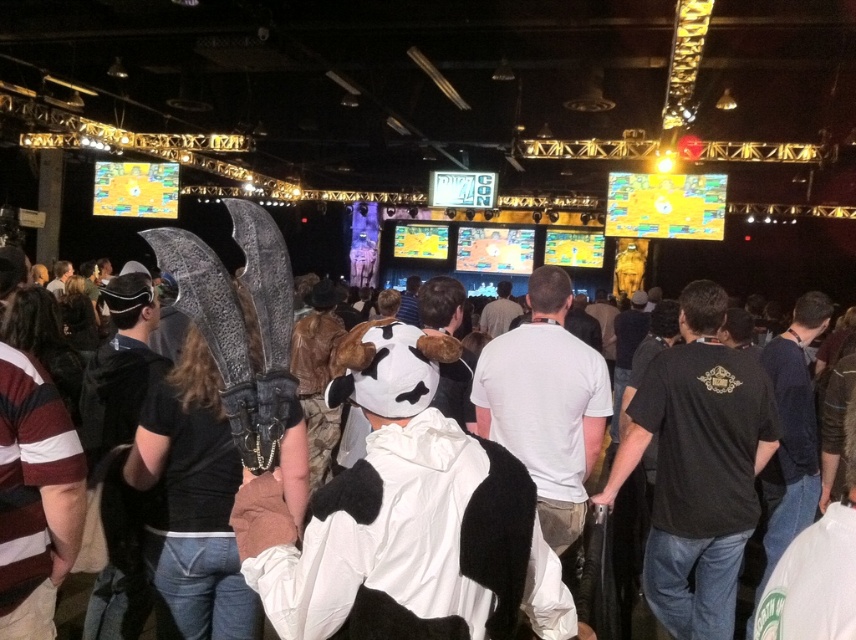
Does white plush cow at center have a smaller size compared to white fur coat at center?

Correct, white plush cow at center occupies less space than white fur coat at center.

Is point (366, 364) behind point (530, 296)?

That is False.

Is point (270, 602) in front of point (590, 460)?

Yes, it is.

You are a GUI agent. You are given a task and a screenshot of the screen. Output one action in this format:
    pyautogui.click(x=<x>, y=<y>)
    Task: Click on the white plush cow at center
    The height and width of the screenshot is (640, 856).
    Given the screenshot: What is the action you would take?
    pyautogui.click(x=403, y=518)